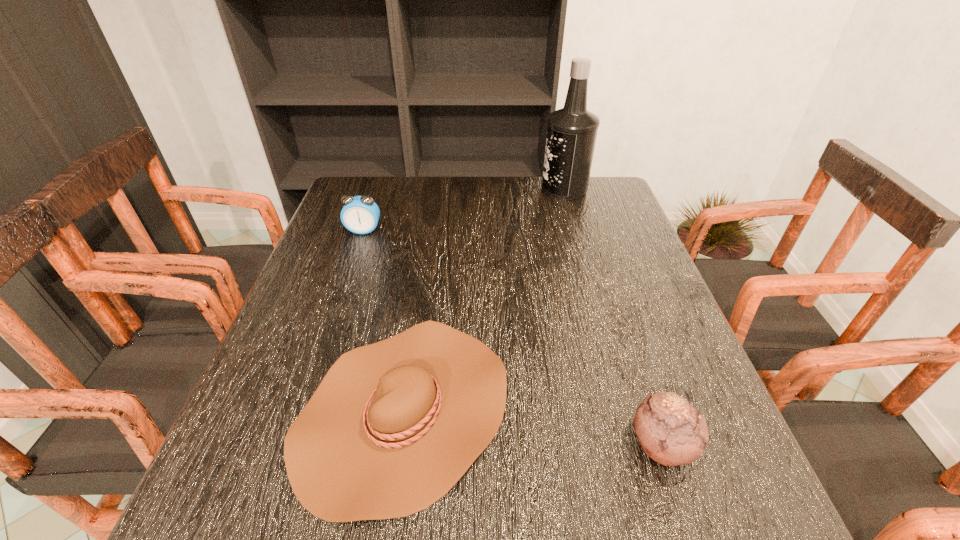
Where is `free point at the left edge`? The height and width of the screenshot is (540, 960). free point at the left edge is located at coordinates (370, 247).

Where is `free spot at the right edge of the desktop`? The height and width of the screenshot is (540, 960). free spot at the right edge of the desktop is located at coordinates (609, 227).

Where is `blank area at the far left corner`? blank area at the far left corner is located at coordinates click(x=388, y=176).

The height and width of the screenshot is (540, 960). In order to click on vacant space at the near left corner of the desktop in this screenshot , I will do `click(231, 521)`.

At what (x,y) coordinates should I click in order to perform the action: click on free region at the far right corner of the desktop. Please return your answer as a coordinate pair (x, y). Looking at the image, I should click on (589, 178).

Locate an element on the screen. The image size is (960, 540). blank space at the near right corner is located at coordinates (687, 535).

At what (x,y) coordinates should I click in order to perform the action: click on free space between the cowboy hat and the muffin. Please return your answer as a coordinate pair (x, y). This screenshot has height=540, width=960. Looking at the image, I should click on (533, 428).

Find the location of a particular element. free spot between the muffin and the cowboy hat is located at coordinates (533, 428).

What are the coordinates of `free space between the tallest object and the muffin` in the screenshot? It's located at (612, 316).

Locate an element on the screen. The image size is (960, 540). free space that is in between the second farthest object and the cowboy hat is located at coordinates (384, 321).